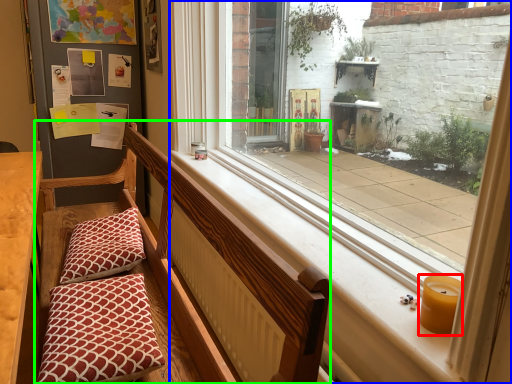
Question: Estimate the real-world distances between objects in this image. Which object is closer to candle holder (highlighted by a red box), window (highlighted by a blue box) or church bench (highlighted by a green box)?

Choices:
 (A) window
 (B) church bench

Answer: (A)